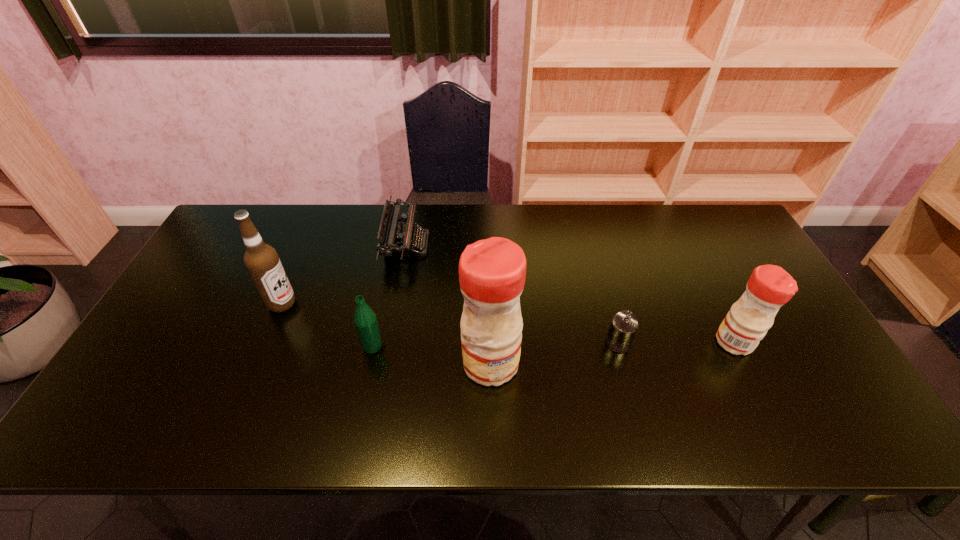
Where is `free space between the bottle and the farthest object`? free space between the bottle and the farthest object is located at coordinates (390, 295).

Find the location of a particular element. Image resolution: width=960 pixels, height=540 pixels. vacant area between the alcohol and the second object from right to left is located at coordinates (450, 323).

Identify which object is the third nearest to the leftmost object. Please provide its 2D coordinates. Your answer should be formatted as a tuple, i.e. [(x, y)], where the tuple contains the x and y coordinates of a point satisfying the conditions above.

[(492, 272)]

Identify which object is the closest to the second object from right to left. Please provide its 2D coordinates. Your answer should be formatted as a tuple, i.e. [(x, y)], where the tuple contains the x and y coordinates of a point satisfying the conditions above.

[(769, 287)]

Where is `free space that satisfies the following two spatial constraints: 1. on the typing side of the farthest object; 2. on the front side of the fourth tallest object`? This screenshot has height=540, width=960. free space that satisfies the following two spatial constraints: 1. on the typing side of the farthest object; 2. on the front side of the fourth tallest object is located at coordinates (388, 346).

What are the coordinates of `free space in the image that satisfies the following two spatial constraints: 1. on the back side of the third shortest object; 2. on the label of the fifth shortest object` in the screenshot? It's located at (381, 303).

Identify the location of free space in the image that satisfies the following two spatial constraints: 1. on the label of the second farthest object; 2. on the left side of the second object from right to left. The image size is (960, 540). (265, 343).

Find the location of a particular element. free space that satisfies the following two spatial constraints: 1. on the label of the fifth shortest object; 2. on the right side of the third tallest object is located at coordinates (266, 342).

Locate an element on the screen. Image resolution: width=960 pixels, height=540 pixels. vacant space that satisfies the following two spatial constraints: 1. on the typing side of the tallest object; 2. on the left side of the farthest object is located at coordinates (385, 363).